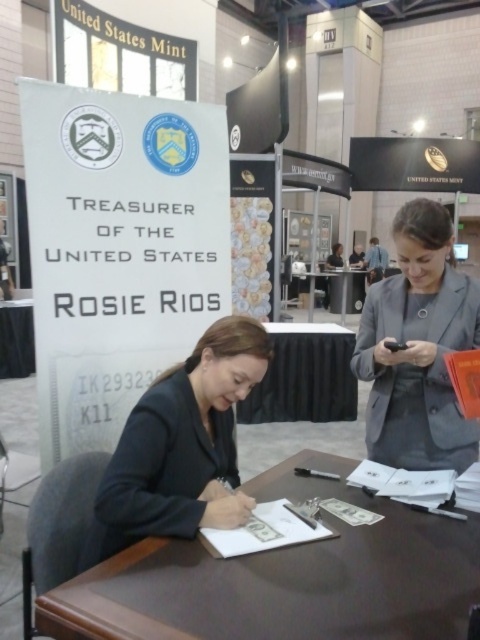
You are standing in front of the U.S. Mint booth and notice two points marked on the floor. The first point is at coordinates point (79,602) and the second is at point (28,316). Which point is closer to you?

Point (79,602) is closer to the camera than point (28,316), so the first point is closer to you.